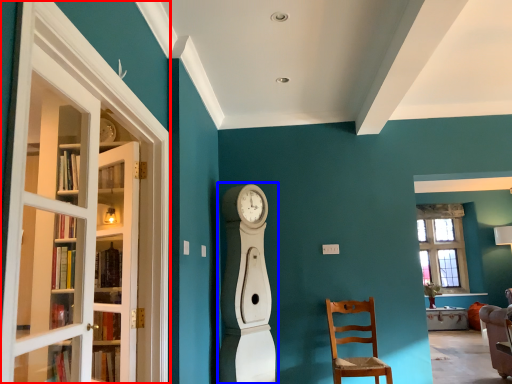
Question: Among these objects, which one is farthest to the camera, screen door (highlighted by a red box) or open (highlighted by a blue box)?

Choices:
 (A) screen door
 (B) open

Answer: (B)